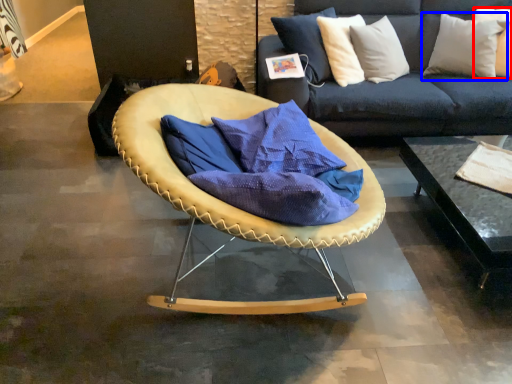
Question: Which point is closer to the camera, pillow (highlighted by a red box) or pillow (highlighted by a blue box)?

Choices:
 (A) pillow
 (B) pillow

Answer: (B)